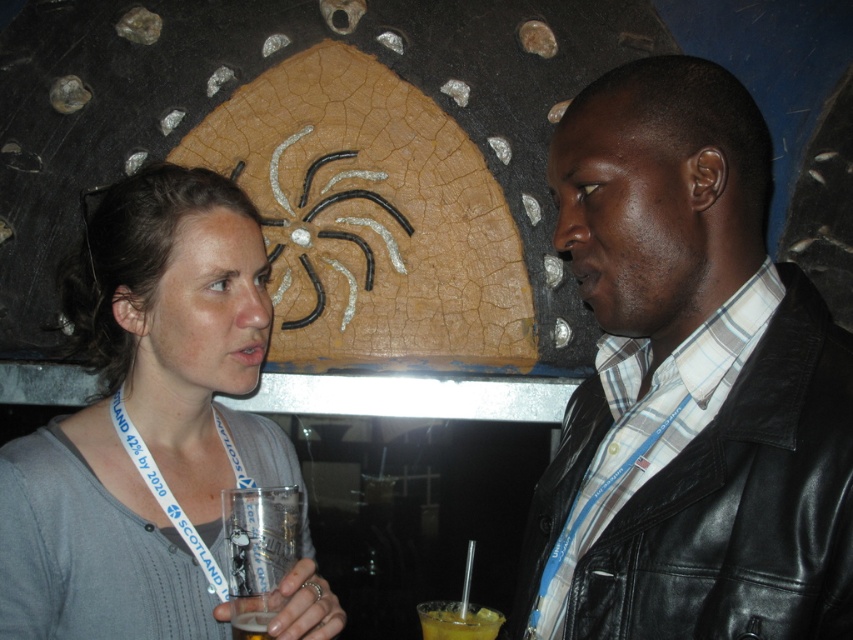
You are at a party and want to grab a drink from the table. There is a gray cotton shirt at left and a yellow translucent drink at lower center. Which object is closer to you if you are facing the scene?

The gray cotton shirt at left is closer to you because it is in front of the yellow translucent drink at lower center.